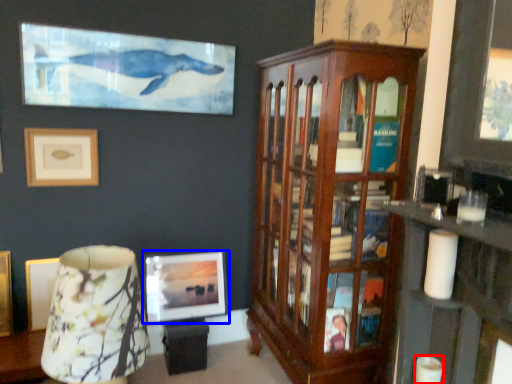
Question: Which point is closer to the camera, candle (highlighted by a red box) or picture frame (highlighted by a blue box)?

Choices:
 (A) candle
 (B) picture frame

Answer: (A)